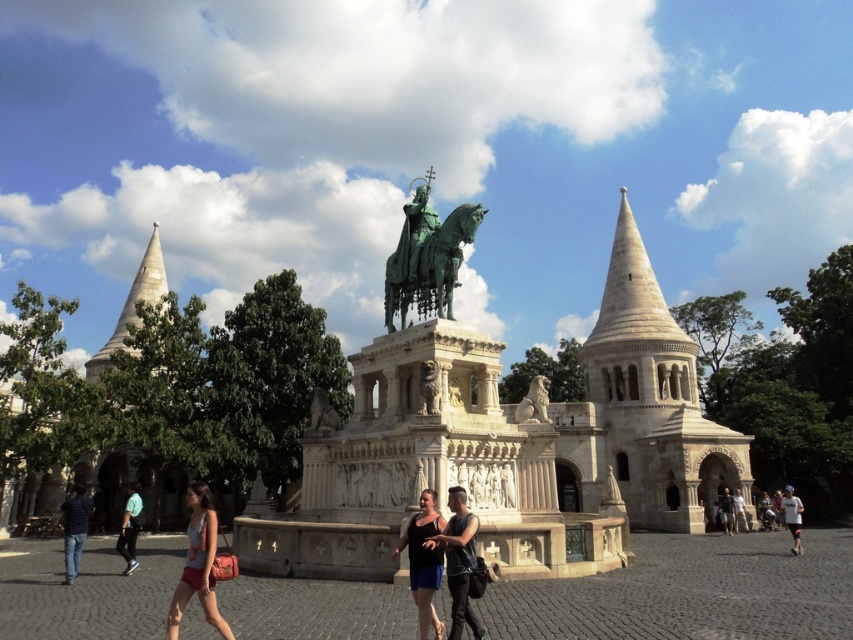
In the scene shown: Measure the distance between point (480, 628) and camera.

They are 105.65 feet apart.

Can you confirm if black leather jacket at center is positioned to the right of white cotton shirt at center?

In fact, black leather jacket at center is to the left of white cotton shirt at center.

Measure the distance between point [462,572] and camera.

Point [462,572] and camera are 34.32 meters apart from each other.

This screenshot has width=853, height=640. What are the coordinates of `black leather jacket at center` in the screenshot? It's located at (459, 561).

How far apart are dark blue jeans at lower left and white cotton shirt at center?

235.87 feet

Is dark blue jeans at lower left further to camera compared to white cotton shirt at center?

No, dark blue jeans at lower left is closer to the viewer.

Is point (62, 550) closer to viewer compared to point (796, 520)?

No.

I want to click on dark blue jeans at lower left, so click(x=74, y=529).

Which is more to the left, matte pink shorts at lower left or dark blue jeans at lower left?

From the viewer's perspective, dark blue jeans at lower left appears more on the left side.

Is matte pink shorts at lower left below dark blue jeans at lower left?

No, matte pink shorts at lower left is not below dark blue jeans at lower left.

At what (x,y) coordinates should I click in order to perform the action: click on matte pink shorts at lower left. Please return your answer as a coordinate pair (x, y). This screenshot has width=853, height=640. Looking at the image, I should click on (198, 564).

What are the coordinates of `matte pink shorts at lower left` in the screenshot? It's located at (198, 564).